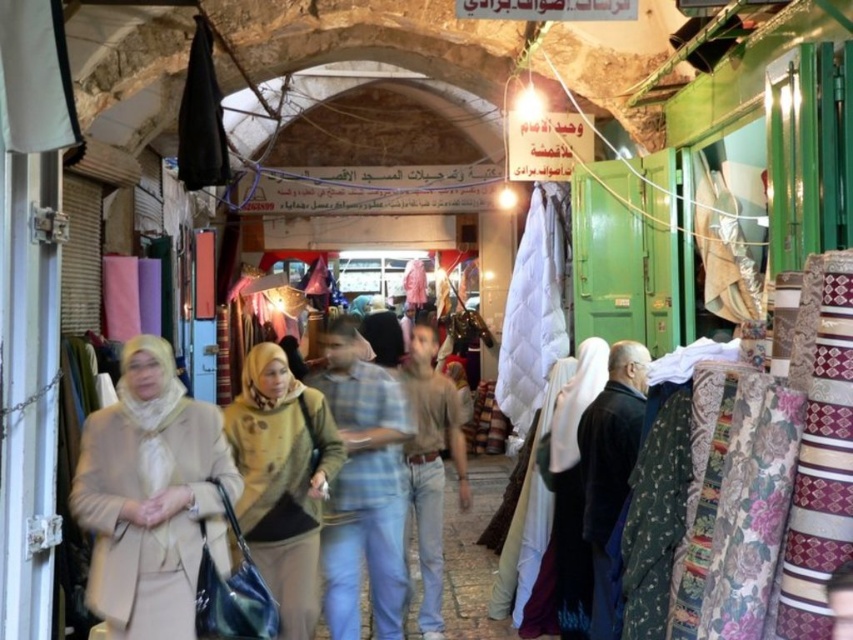
Question: Which object appears closest to the camera in this image?

Choices:
 (A) light blue jeans at center
 (B) beige fabric coat at center

Answer: (B)

Question: Does beige fabric coat at center have a smaller size compared to denim jeans at center?

Choices:
 (A) yes
 (B) no

Answer: (B)

Question: Does beige knitted sweater at center appear on the left side of dark blue fabric at right?

Choices:
 (A) yes
 (B) no

Answer: (A)

Question: Which point is farther from the camera taking this photo?

Choices:
 (A) (637, 346)
 (B) (346, 547)

Answer: (B)

Question: Is beige knitted sweater at center to the right of light blue jeans at center from the viewer's perspective?

Choices:
 (A) no
 (B) yes

Answer: (A)

Question: Which of these objects is positioned closest to the beige fabric coat at center?

Choices:
 (A) dark blue fabric at right
 (B) beige knitted sweater at center
 (C) light blue jeans at center

Answer: (B)